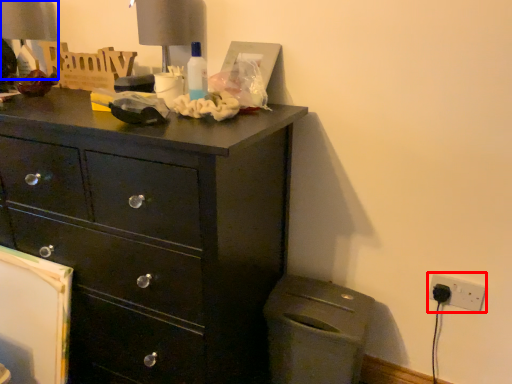
Question: Which object appears farthest to the camera in this image, electric outlet (highlighted by a red box) or table lamp (highlighted by a blue box)?

Choices:
 (A) electric outlet
 (B) table lamp

Answer: (B)